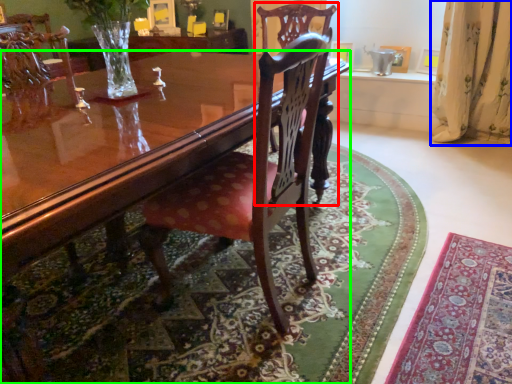
Question: Based on their relative distances, which object is nearer to chair (highlighted by a red box)? Choose from curtain (highlighted by a blue box) and coffee table (highlighted by a green box).

Choices:
 (A) curtain
 (B) coffee table

Answer: (B)